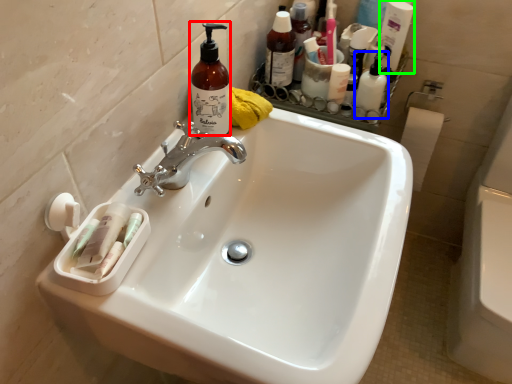
Question: Which is nearer to the cleaning product (highlighted by a red box)? toiletry (highlighted by a blue box) or cleaning product (highlighted by a green box).

Choices:
 (A) toiletry
 (B) cleaning product

Answer: (A)